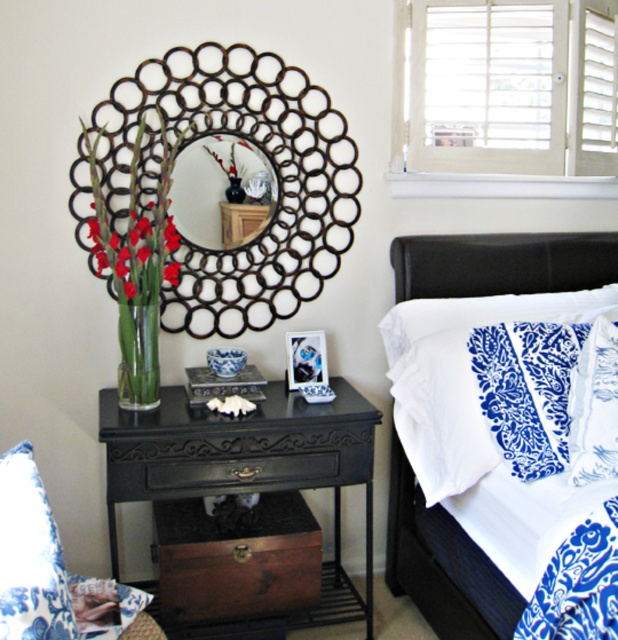
Does rustic wood chest at lower center have a lesser height compared to black leather headboard at upper right?

Incorrect, rustic wood chest at lower center's height does not fall short of black leather headboard at upper right's.

Who is positioned more to the left, rustic wood chest at lower center or black leather headboard at upper right?

From the viewer's perspective, rustic wood chest at lower center appears more on the left side.

Where is `rustic wood chest at lower center`? This screenshot has height=640, width=618. rustic wood chest at lower center is located at coordinates (235, 561).

The image size is (618, 640). In order to click on rustic wood chest at lower center in this screenshot , I will do `click(235, 561)`.

Can you confirm if black wood dresser at lower left is shorter than translucent glass vase at left?

Yes, black wood dresser at lower left is shorter than translucent glass vase at left.

This screenshot has width=618, height=640. What do you see at coordinates (248, 465) in the screenshot?
I see `black wood dresser at lower left` at bounding box center [248, 465].

What do you see at coordinates (248, 465) in the screenshot? The image size is (618, 640). I see `black wood dresser at lower left` at bounding box center [248, 465].

At what (x,y) coordinates should I click in order to perform the action: click on black wood dresser at lower left. Please return your answer as a coordinate pair (x, y). The height and width of the screenshot is (640, 618). Looking at the image, I should click on (248, 465).

Which is above, blue printed fabric pillow at lower left or metallic circular mirror at center?

metallic circular mirror at center is above.

Can you confirm if blue printed fabric pillow at lower left is wider than metallic circular mirror at center?

No, blue printed fabric pillow at lower left is not wider than metallic circular mirror at center.

Image resolution: width=618 pixels, height=640 pixels. What are the coordinates of `blue printed fabric pillow at lower left` in the screenshot? It's located at (30, 556).